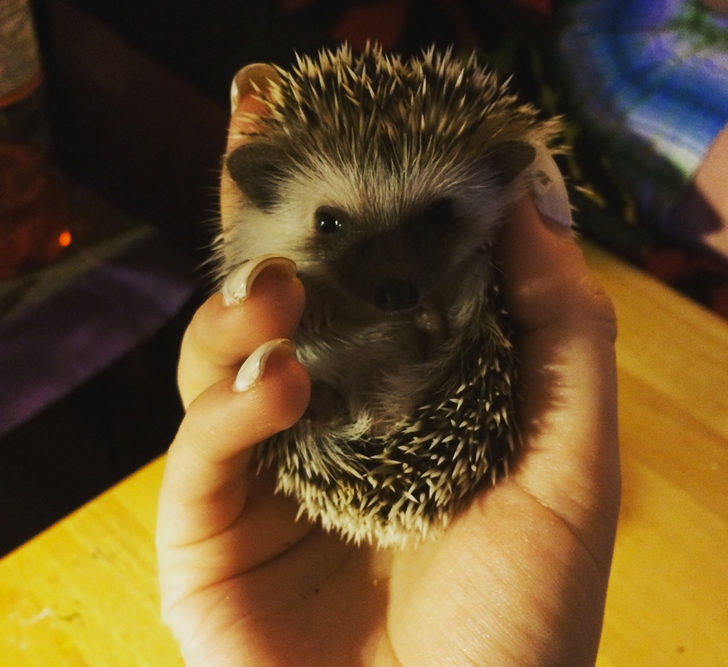
Locate an element on the screen. table is located at coordinates (110, 594).